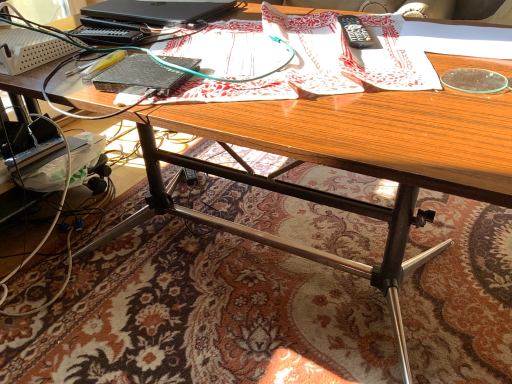
The width and height of the screenshot is (512, 384). Find the location of `vacant point to the right of black matte laptop at upper left`. vacant point to the right of black matte laptop at upper left is located at coordinates (269, 18).